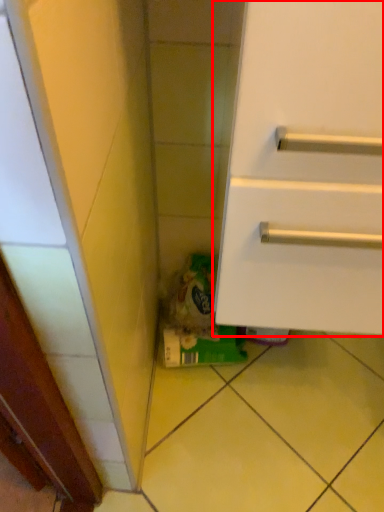
Question: In this image, where is cabinetry (annotated by the red box) located relative to garbage?

Choices:
 (A) right
 (B) left

Answer: (A)